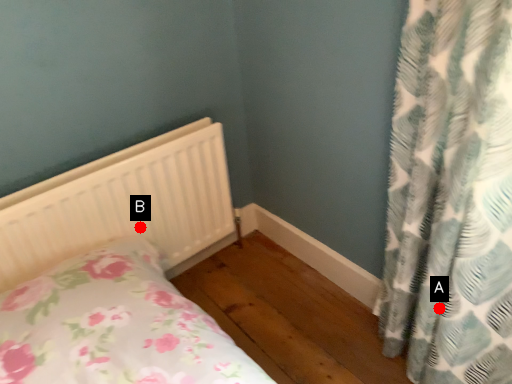
Question: Two points are circled on the image, labeled by A and B beside each circle. Which point is farther from the camera taking this photo?

Choices:
 (A) A is further
 (B) B is further

Answer: (B)